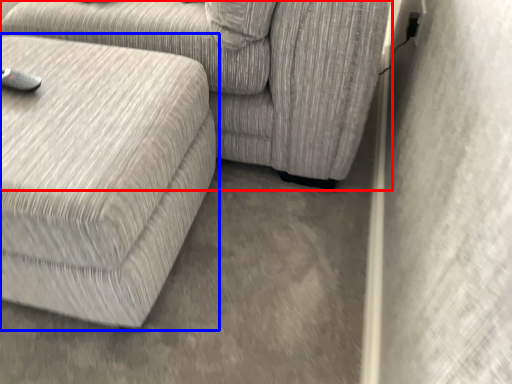
Question: Which object appears farthest to the camera in this image, studio couch (highlighted by a red box) or studio couch (highlighted by a blue box)?

Choices:
 (A) studio couch
 (B) studio couch

Answer: (A)